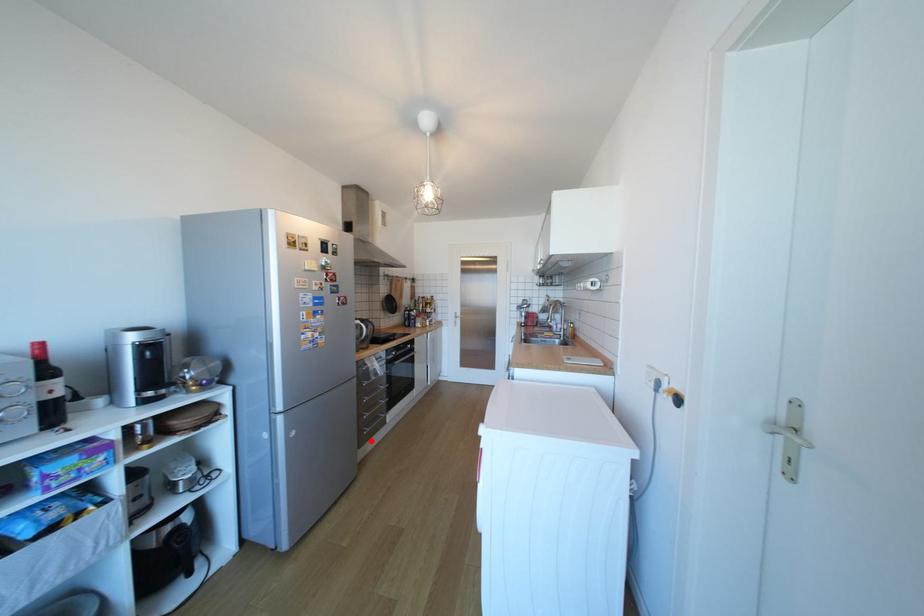
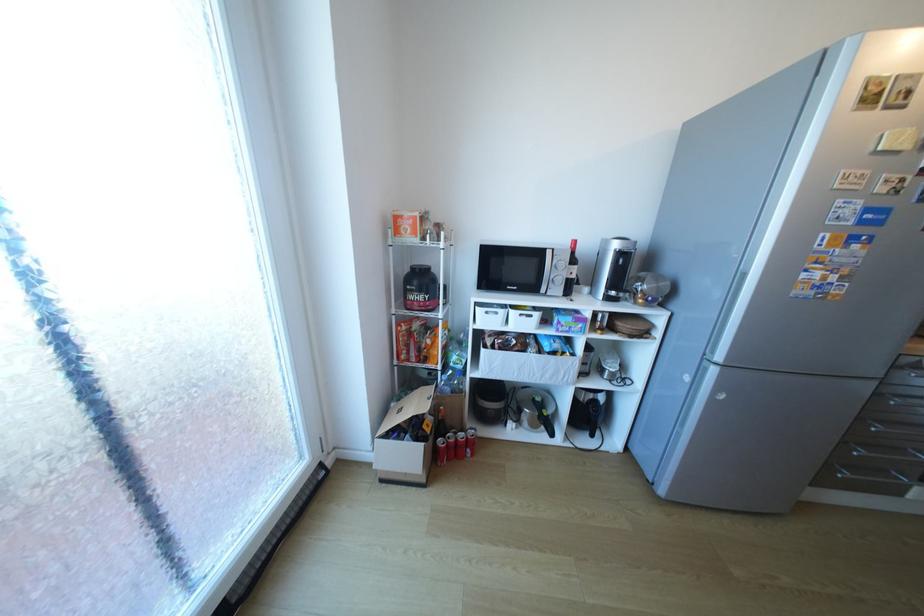
Question: I am providing you with two images of the same scene from different viewpoints. Given a red point in image1, look at the same physical point in image2. Is it:

Choices:
 (A) Closer to the viewpoint
 (B) Farther from the viewpoint

Answer: (A)